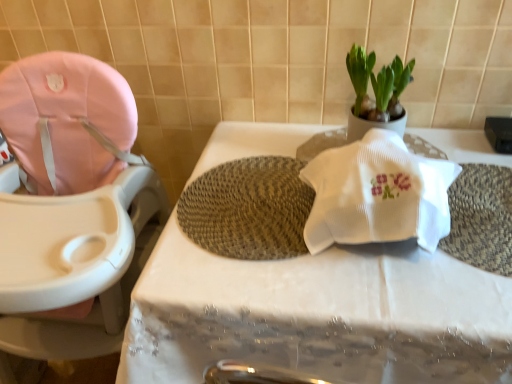
In order to click on blank space situated above woven beige bath mat at center (from a real-world perspective) in this screenshot , I will do `click(253, 199)`.